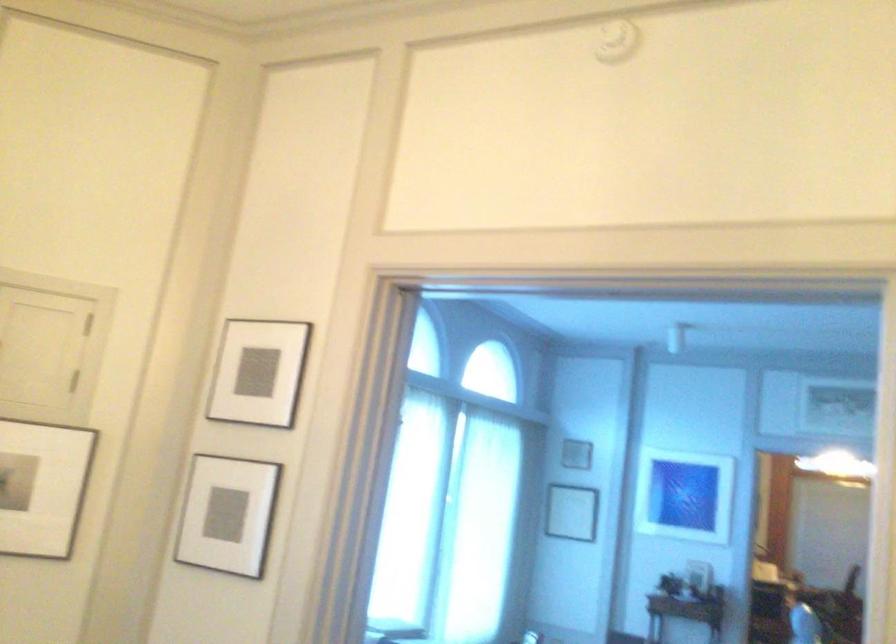
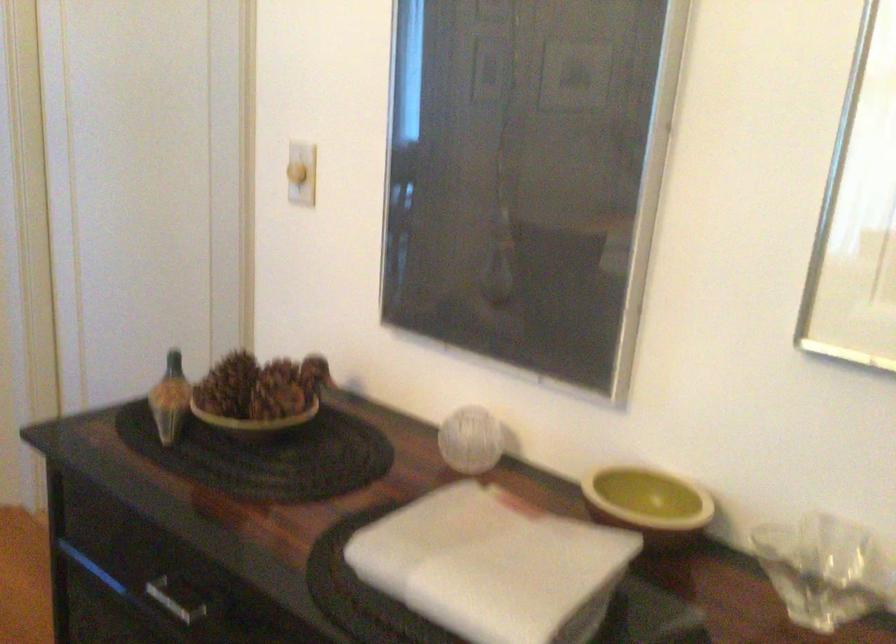
First-person continuous shooting, in which direction is the camera rotating?

The camera rotated toward right-down.